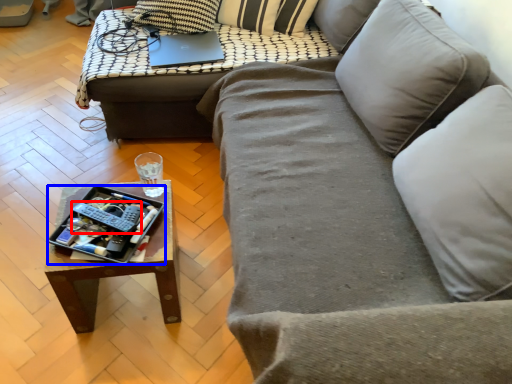
Question: Among these objects, which one is nearest to the camera, remote (highlighted by a red box) or tray (highlighted by a blue box)?

Choices:
 (A) remote
 (B) tray

Answer: (B)